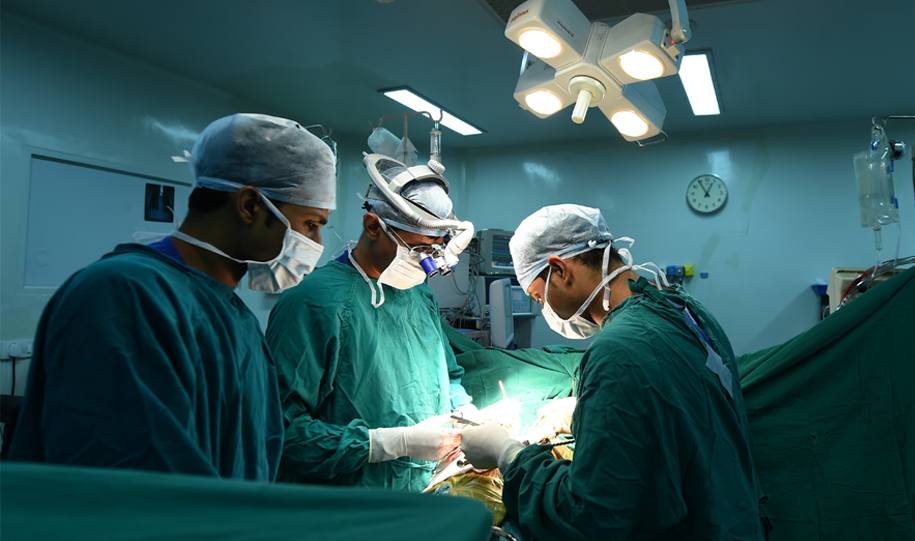
Identify the location of lights. (533, 109), (541, 39), (644, 61), (636, 140), (701, 89), (425, 116).